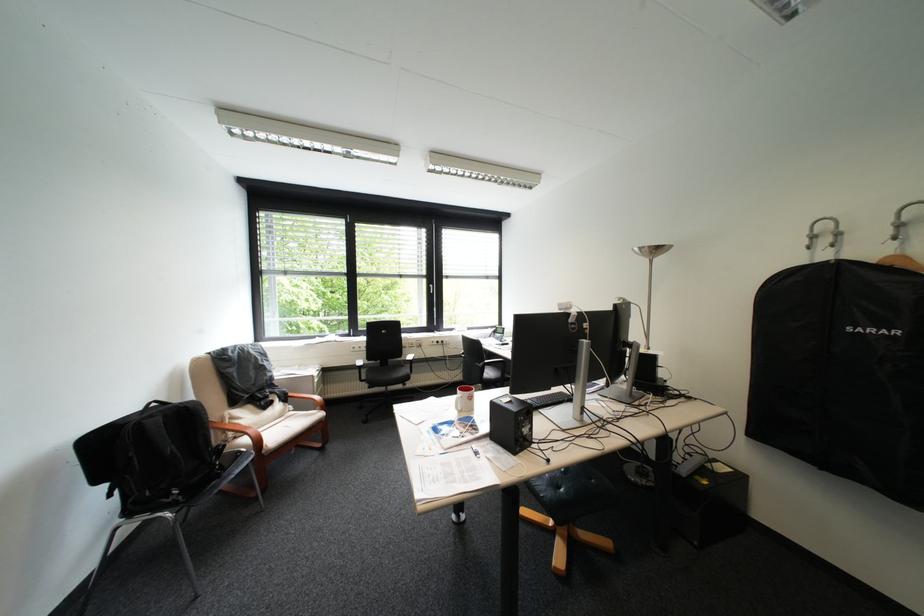
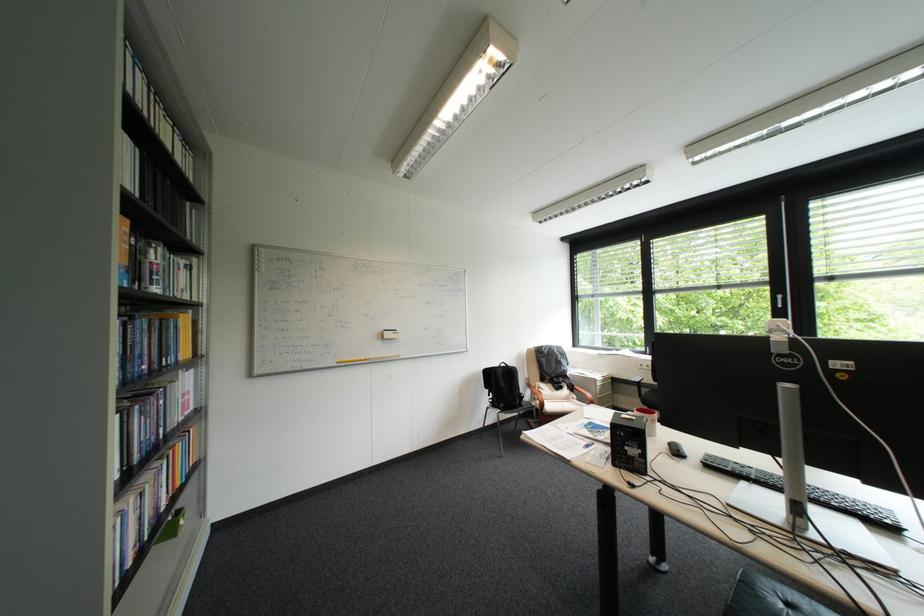
The point at (283, 408) is marked in the first image. Where is the corresponding point in the second image?

(573, 391)